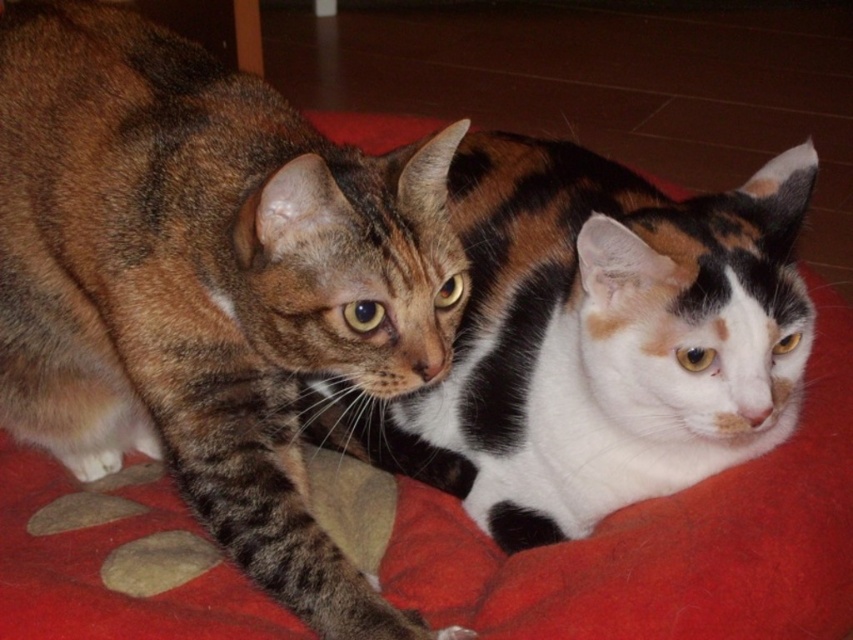
Question: Among these objects, which one is nearest to the camera?

Choices:
 (A) tabby fur cat at left
 (B) tabby fur cat at center

Answer: (A)

Question: From the image, what is the correct spatial relationship of tabby fur cat at left in relation to tabby fur cat at center?

Choices:
 (A) left
 (B) right

Answer: (A)

Question: Which point is farther to the camera?

Choices:
 (A) tabby fur cat at center
 (B) tabby fur cat at left

Answer: (A)

Question: Does tabby fur cat at left have a greater width compared to tabby fur cat at center?

Choices:
 (A) no
 (B) yes

Answer: (A)

Question: Is tabby fur cat at left thinner than tabby fur cat at center?

Choices:
 (A) no
 (B) yes

Answer: (B)